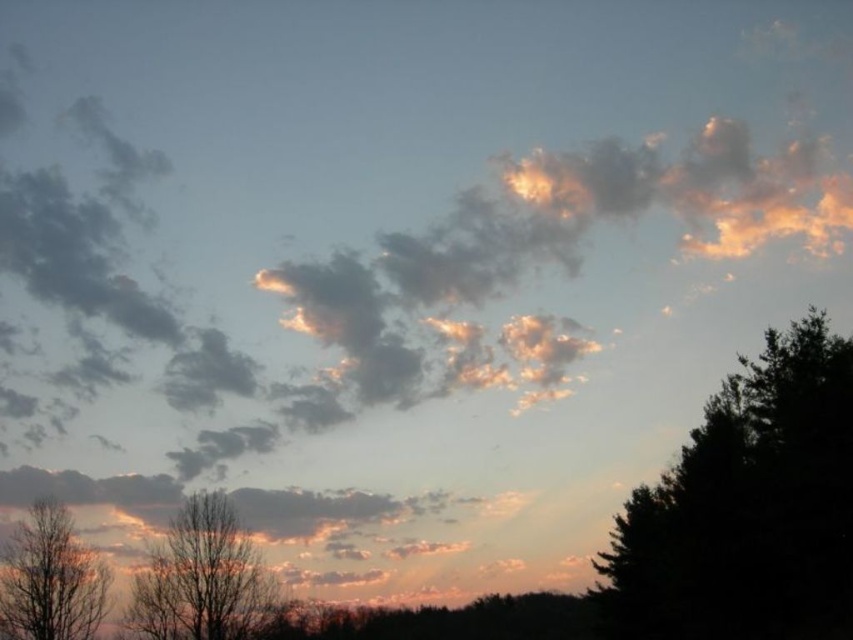
Is silvery bark tree at lower left closer to camera compared to bare wood tree at lower left?

No, silvery bark tree at lower left is further to the viewer.

Who is lower down, silvery bark tree at lower left or bare wood tree at lower left?

Positioned lower is bare wood tree at lower left.

Which is behind, point (193, 518) or point (32, 605)?

The point (193, 518) is more distant.

Locate an element on the screen. The width and height of the screenshot is (853, 640). silvery bark tree at lower left is located at coordinates (202, 579).

Consider the image. Measure the distance from dark green leafy tree at right to silvery bark tree at lower left.

The distance of dark green leafy tree at right from silvery bark tree at lower left is 75.90 feet.

Who is more forward, (839, 390) or (189, 522)?

Point (839, 390) is more forward.

The image size is (853, 640). Identify the location of dark green leafy tree at right. (747, 508).

Between point (666, 566) and point (57, 544), which one is positioned behind?

Point (666, 566)

Does dark green leafy tree at right appear over bare wood tree at lower left?

Yes, dark green leafy tree at right is above bare wood tree at lower left.

Is point (682, 609) closer to camera compared to point (28, 538)?

That is True.

Image resolution: width=853 pixels, height=640 pixels. In order to click on dark green leafy tree at right in this screenshot , I will do `click(747, 508)`.